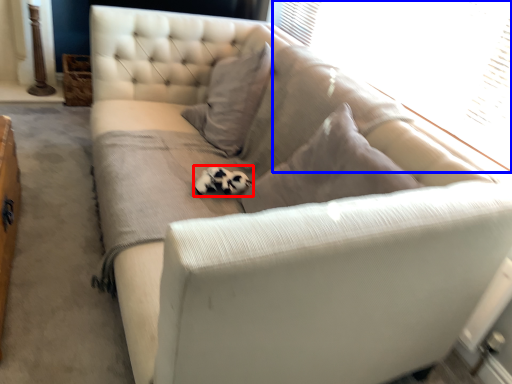
Question: Which point is closer to the camera, animal (highlighted by a red box) or window screen (highlighted by a blue box)?

Choices:
 (A) animal
 (B) window screen

Answer: (B)